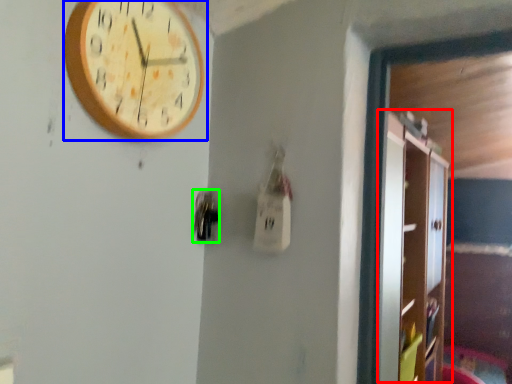
Question: Which object is the closest to the dresser (highlighted by a red box)? Choose among these: wall clock (highlighted by a blue box) or door handle (highlighted by a green box).

Choices:
 (A) wall clock
 (B) door handle

Answer: (A)